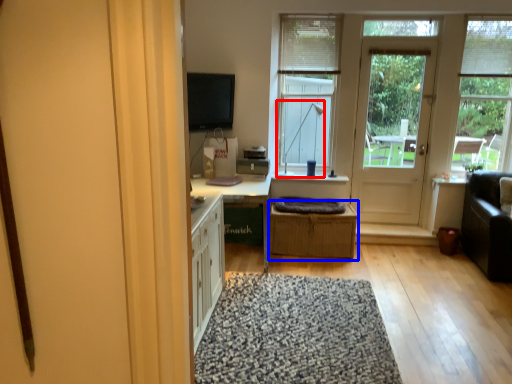
Question: Which point is further to the camera, lamp (highlighted by a red box) or crate (highlighted by a blue box)?

Choices:
 (A) lamp
 (B) crate

Answer: (A)